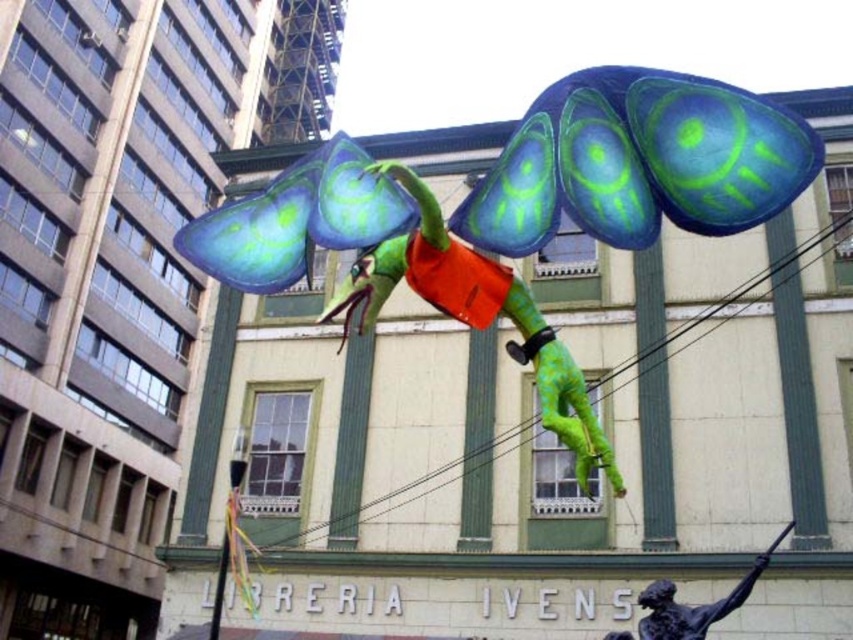
Question: Which point is closer to the camera?

Choices:
 (A) green matte sculpture at center
 (B) bronze statue at lower right

Answer: (A)

Question: Which object is farther from the camera taking this photo?

Choices:
 (A) bronze statue at lower right
 (B) green matte sculpture at center

Answer: (A)

Question: Which object appears farthest from the camera in this image?

Choices:
 (A) bronze statue at lower right
 (B) green matte sculpture at center

Answer: (A)

Question: Can you confirm if green matte sculpture at center is wider than bronze statue at lower right?

Choices:
 (A) no
 (B) yes

Answer: (B)

Question: Considering the relative positions of green matte sculpture at center and bronze statue at lower right in the image provided, where is green matte sculpture at center located with respect to bronze statue at lower right?

Choices:
 (A) left
 (B) right

Answer: (A)

Question: Does green matte sculpture at center appear under bronze statue at lower right?

Choices:
 (A) no
 (B) yes

Answer: (A)